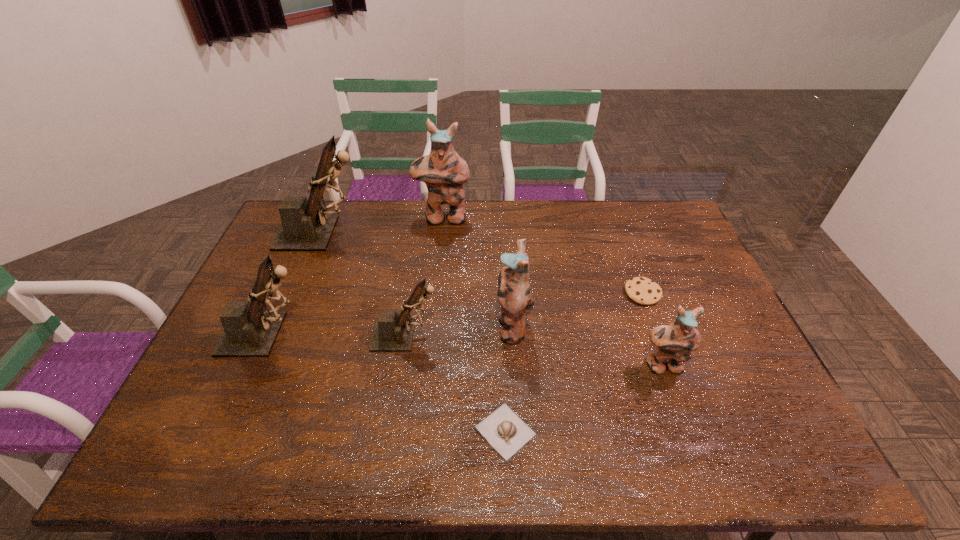
Find the location of a particular element. The image size is (960, 540). object that is the nearest to the biggest pink figurine is located at coordinates (305, 226).

Where is `figurine that is the fourth closest one to the garlic`? figurine that is the fourth closest one to the garlic is located at coordinates (250, 329).

Point out which figurine is positioned as the fourth nearest to the second biggest brown figurine. Please provide its 2D coordinates. Your answer should be formatted as a tuple, i.e. [(x, y)], where the tuple contains the x and y coordinates of a point satisfying the conditions above.

[(514, 292)]

In order to click on pink figurine that is the closest to the second farthest pink figurine in this screenshot , I will do `click(673, 343)`.

Identify which pink figurine is the third closest to the farthest brown figurine. Please provide its 2D coordinates. Your answer should be formatted as a tuple, i.e. [(x, y)], where the tuple contains the x and y coordinates of a point satisfying the conditions above.

[(673, 343)]

Locate which brown figurine ranks second in proximity to the rightmost brown figurine. Please provide its 2D coordinates. Your answer should be formatted as a tuple, i.e. [(x, y)], where the tuple contains the x and y coordinates of a point satisfying the conditions above.

[(305, 226)]

Where is `the second closest brown figurine relative to the leftmost pink figurine`? the second closest brown figurine relative to the leftmost pink figurine is located at coordinates (392, 332).

At what (x,y) coordinates should I click in order to perform the action: click on vacant area that satisfies the following two spatial constraints: 1. on the front-facing side of the rightmost brown figurine; 2. on the left side of the garlic. Please return your answer as a coordinate pair (x, y). Looking at the image, I should click on (392, 431).

This screenshot has width=960, height=540. Identify the location of vacant space that satisfies the following two spatial constraints: 1. on the front-facing side of the leftmost pink figurine; 2. on the right side of the second shortest object. (436, 293).

You are a GUI agent. You are given a task and a screenshot of the screen. Output one action in this format:
    pyautogui.click(x=<x>, y=<y>)
    Task: Click on the vacant point that satisfies the following two spatial constraints: 1. on the back side of the brown cookie; 2. on the right side of the shortest object
    This screenshot has width=960, height=540.
    Given the screenshot: What is the action you would take?
    pyautogui.click(x=499, y=293)